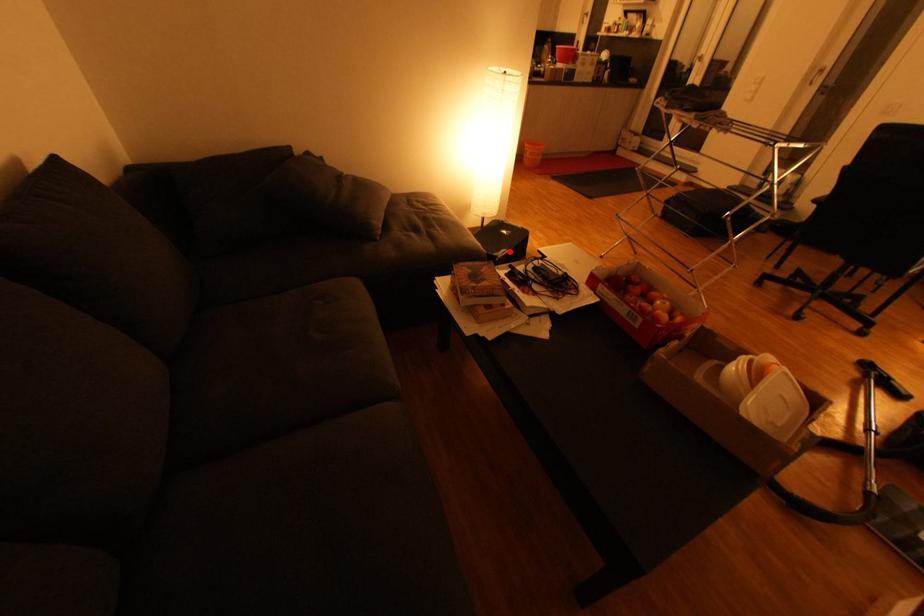
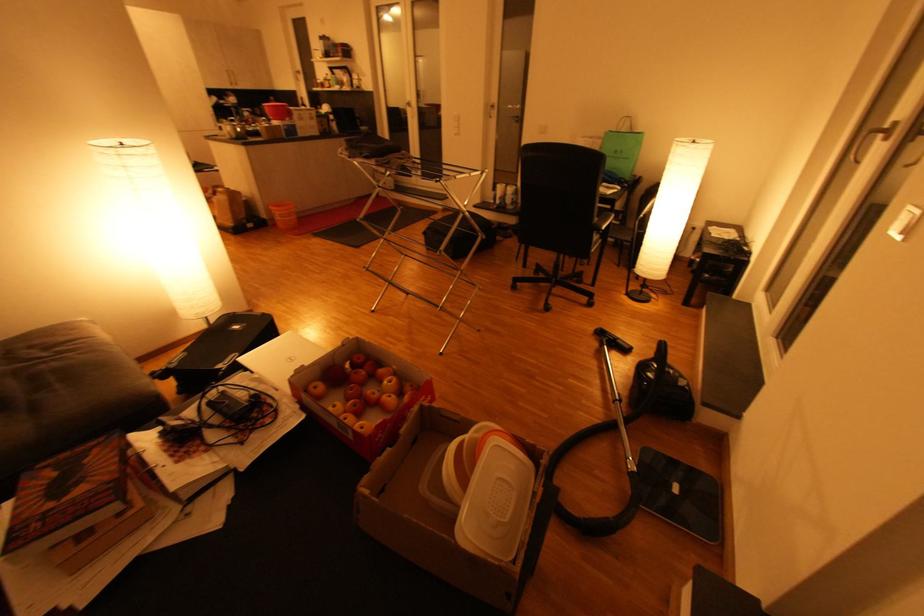
Question: I am providing you with two images of the same scene from different viewpoints. Image1 has a red point marked. In image2, the corresponding 3D location appears at what relative position? Reply with the corresponding letter.

Choices:
 (A) Closer
 (B) Farther

Answer: (B)